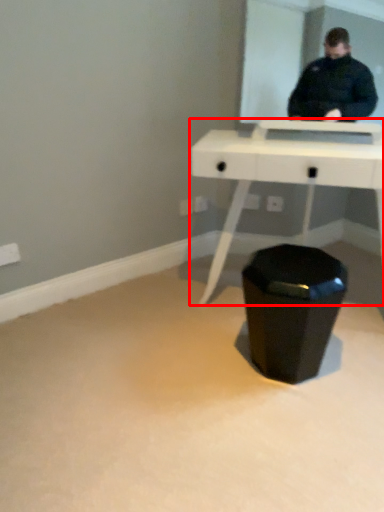
Question: From the image's perspective, what is the correct spatial positioning of table (annotated by the red box) in reference to waste container?

Choices:
 (A) above
 (B) below

Answer: (A)